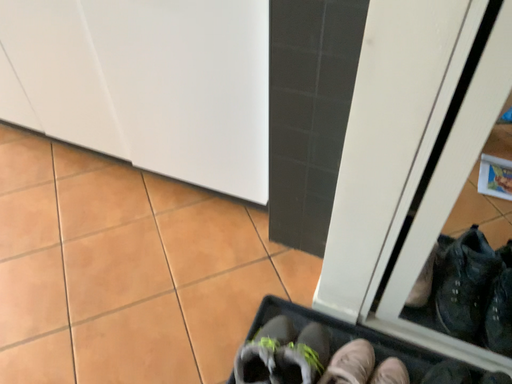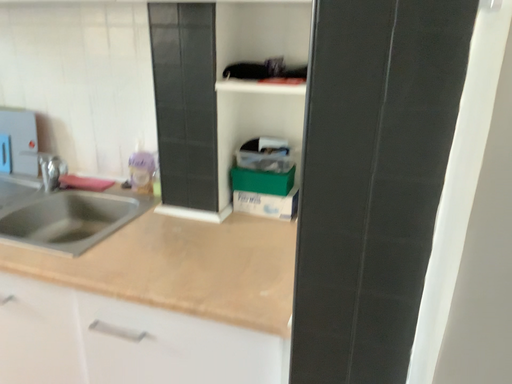
Question: Which way did the camera rotate in the video?

Choices:
 (A) rotated downward
 (B) rotated upward

Answer: (B)